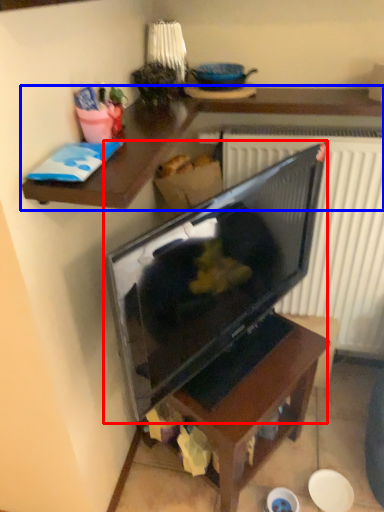
Question: Which point is closer to the camera, television (highlighted by a red box) or desk (highlighted by a blue box)?

Choices:
 (A) television
 (B) desk

Answer: (A)